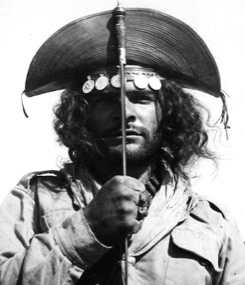
At what (x,y) coordinates should I click in order to perform the action: click on circular coin decorations. Please return your answer as a coordinate pair (x, y). Looking at the image, I should click on (87, 85), (100, 83), (116, 78), (140, 82), (155, 82).